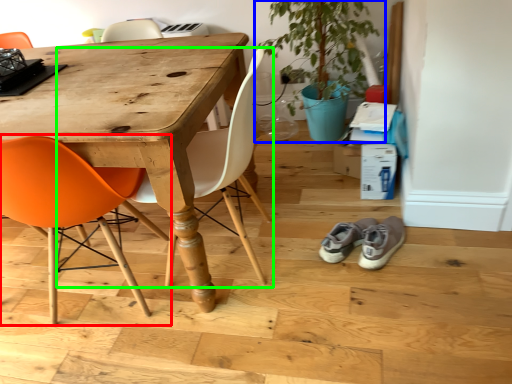
Question: Considering the real-world distances, which object is farthest from chair (highlighted by a red box)? houseplant (highlighted by a blue box) or chair (highlighted by a green box)?

Choices:
 (A) houseplant
 (B) chair

Answer: (A)